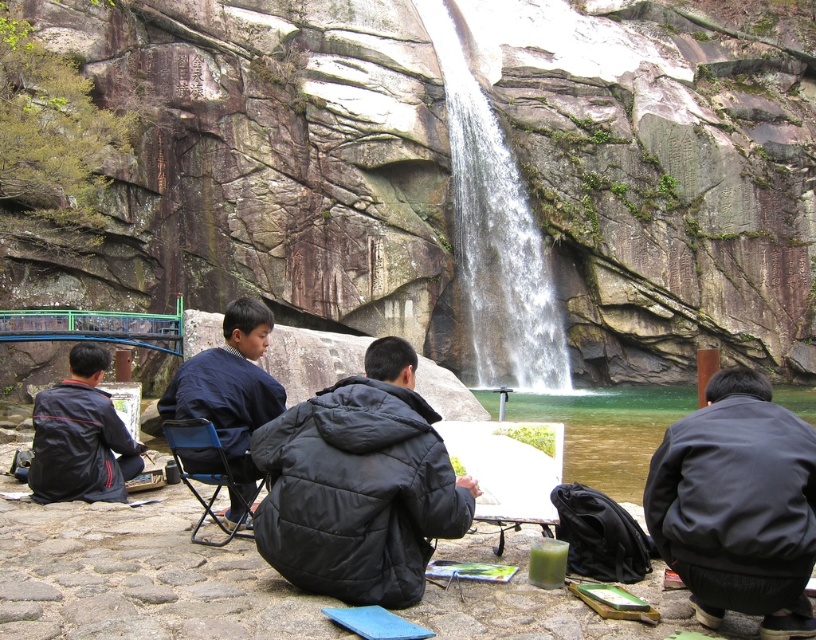
Based on the photo, does green smooth water at center appear on the left side of black matte jacket at lower left?

No, green smooth water at center is not to the left of black matte jacket at lower left.

Is green smooth water at center smaller than black matte jacket at lower left?

Incorrect, green smooth water at center is not smaller in size than black matte jacket at lower left.

Where is `green smooth water at center`? Image resolution: width=816 pixels, height=640 pixels. green smooth water at center is located at coordinates (608, 429).

Does white textured water at center appear on the right side of black matte jacket at lower left?

Yes, white textured water at center is to the right of black matte jacket at lower left.

Does white textured water at center have a greater width compared to black matte jacket at lower left?

Indeed, white textured water at center has a greater width compared to black matte jacket at lower left.

The width and height of the screenshot is (816, 640). Describe the element at coordinates (495, 234) in the screenshot. I see `white textured water at center` at that location.

The height and width of the screenshot is (640, 816). Identify the location of white textured water at center. (495, 234).

Between black matte jacket at lower right and dark blue fabric jacket at center, which one has more height?

Standing taller between the two is dark blue fabric jacket at center.

Does point (725, 460) lie behind point (256, 410)?

No, it is not.

This screenshot has width=816, height=640. Identify the location of black matte jacket at lower right. (737, 506).